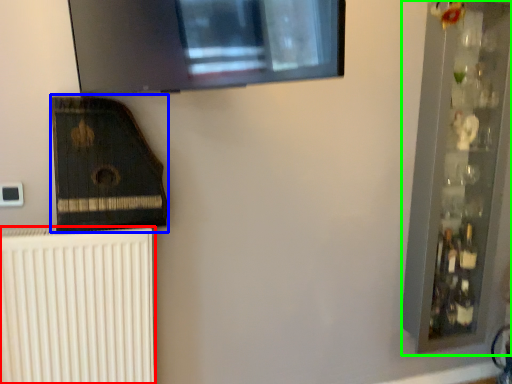
Question: Estimate the real-world distances between objects in this image. Which object is closer to radiator (highlighted by a red box), amplifier (highlighted by a blue box) or shelf (highlighted by a green box)?

Choices:
 (A) amplifier
 (B) shelf

Answer: (A)